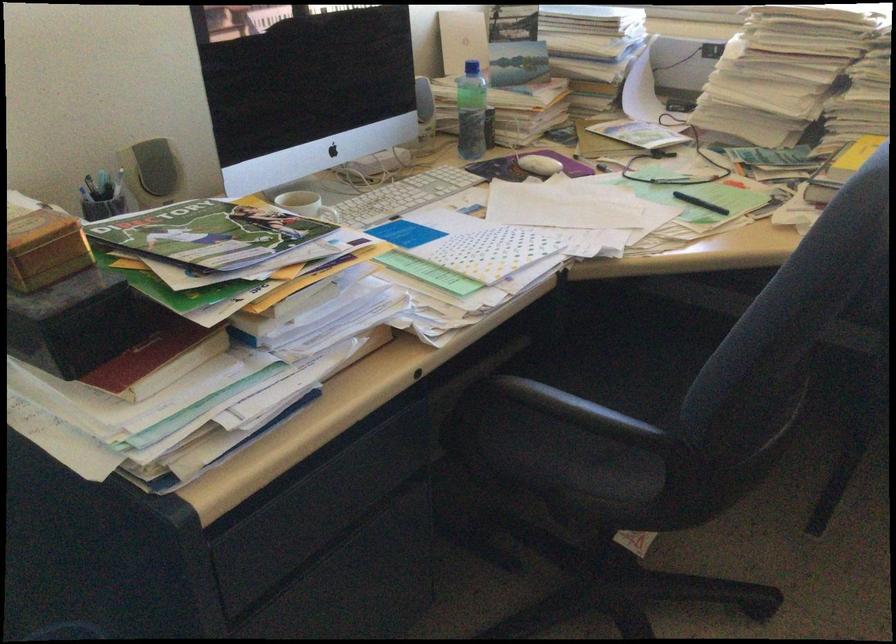
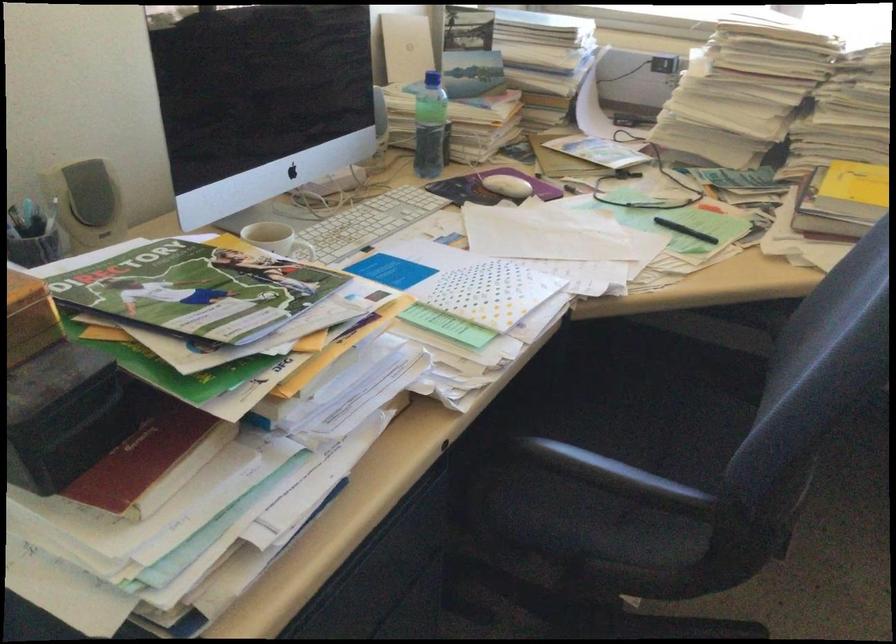
Question: Based on the continuous images, in which direction is the camera rotating? Reply with the corresponding letter.

Choices:
 (A) Left
 (B) Right
 (C) Up
 (D) Down

Answer: (B)